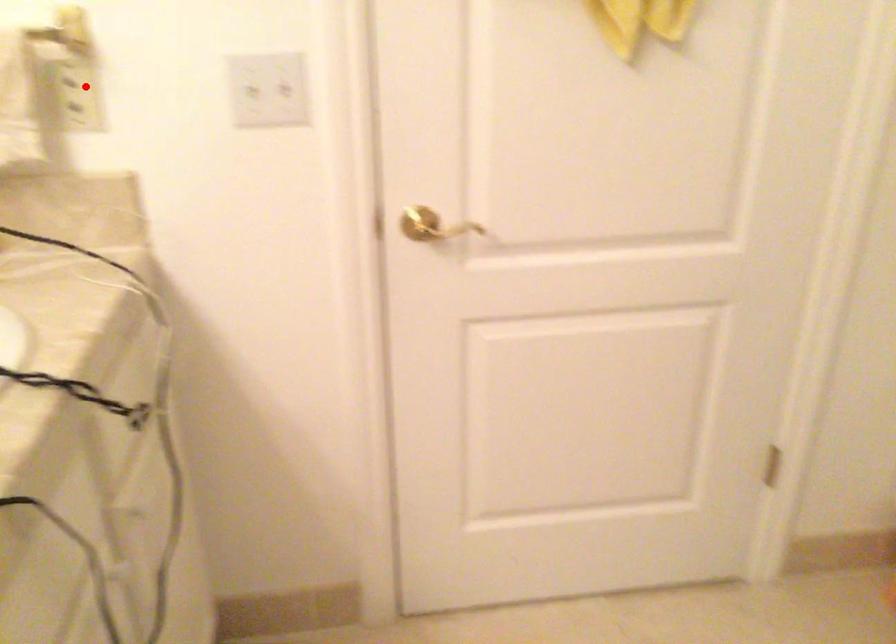
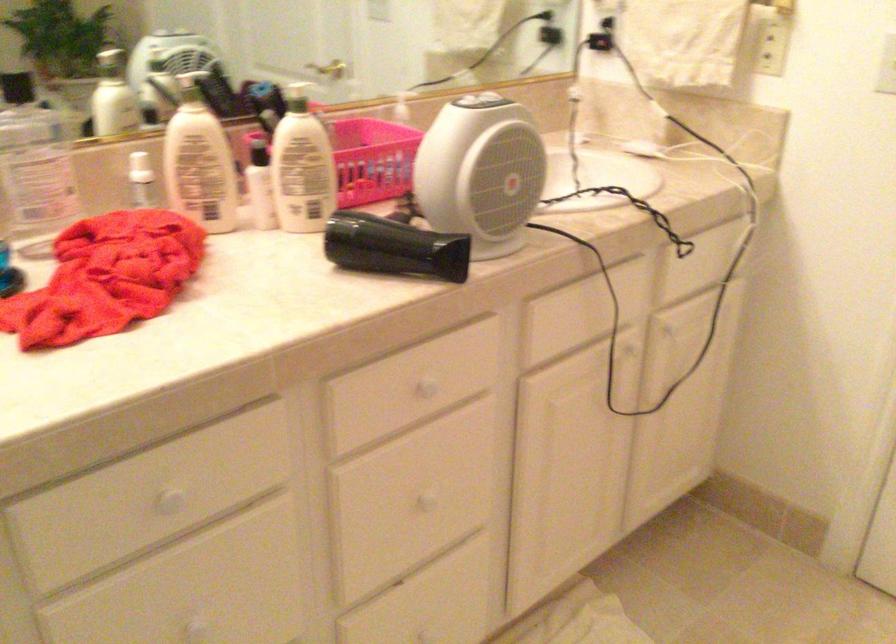
The point at the highlighted location is marked in the first image. Where is the corresponding point in the second image?

(771, 46)